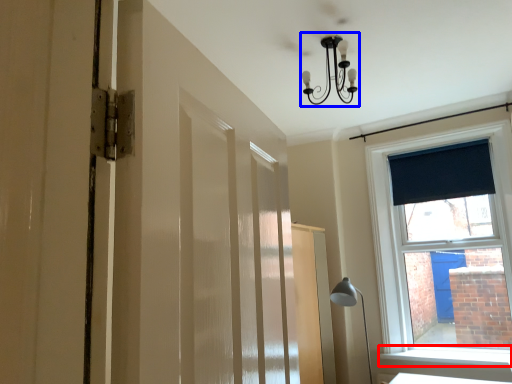
Question: Which of the following is the farthest to the observer, window sill (highlighted by a red box) or light fixture (highlighted by a blue box)?

Choices:
 (A) window sill
 (B) light fixture

Answer: (A)